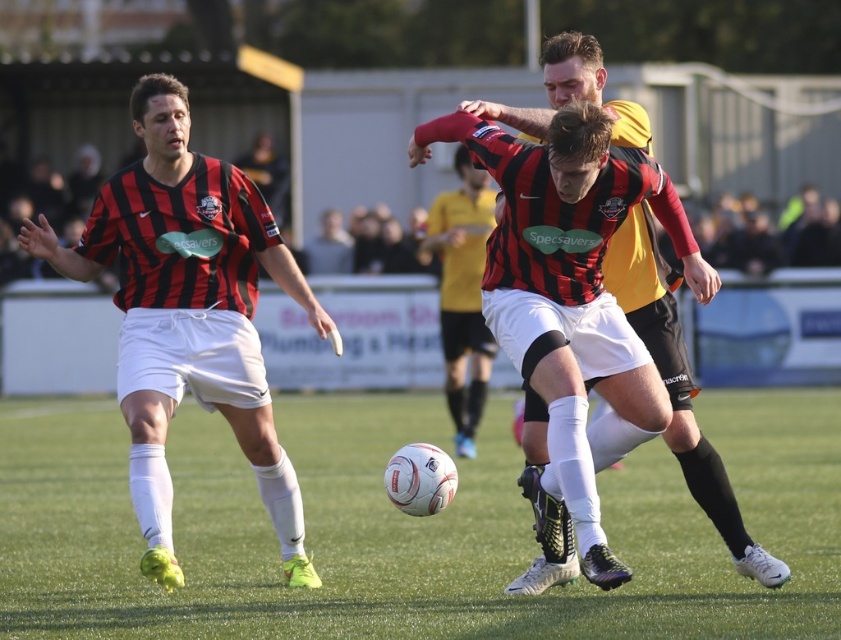
Does matte black soccer ball at center appear over matte black jersey at center?

No.

Which of these two, matte black soccer ball at center or matte black jersey at center, stands shorter?

matte black soccer ball at center

Is point (623, 120) positioned before point (492, 352)?

Yes, point (623, 120) is closer to viewer.

Image resolution: width=841 pixels, height=640 pixels. What are the coordinates of `matte black soccer ball at center` in the screenshot? It's located at (680, 372).

Is point (141, 211) farther from viewer compared to point (659, 346)?

Yes, point (141, 211) is farther from viewer.

Between matte black jersey at left and matte black soccer ball at center, which one has less height?

With less height is matte black soccer ball at center.

Identify the location of matte black jersey at left. This screenshot has width=841, height=640. (188, 314).

Where is `matte black jersey at left`? matte black jersey at left is located at coordinates (188, 314).

Does matte black jersey at left have a larger size compared to matte black jersey at center?

Yes, matte black jersey at left is bigger than matte black jersey at center.

At what (x,y) coordinates should I click in order to perform the action: click on matte black jersey at left. Please return your answer as a coordinate pair (x, y). The image size is (841, 640). Looking at the image, I should click on (188, 314).